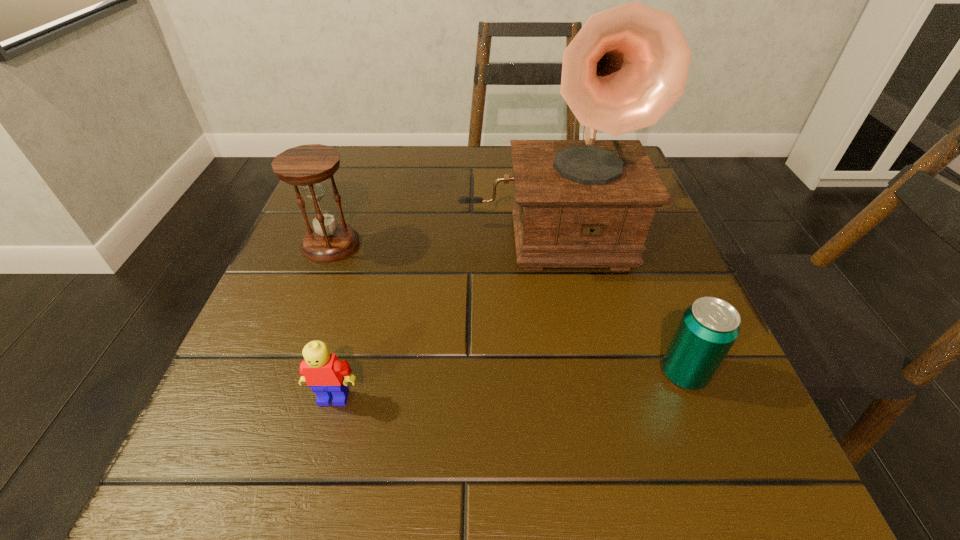
This screenshot has width=960, height=540. Find the location of `free spot between the beer can and the record player`. free spot between the beer can and the record player is located at coordinates (613, 301).

Find the location of a particular element. vacant area that lies between the Lego and the beer can is located at coordinates (509, 386).

Identify the location of vacant region between the tallest object and the beer can. (613, 301).

You are a GUI agent. You are given a task and a screenshot of the screen. Output one action in this format:
    pyautogui.click(x=<x>, y=<y>)
    Task: Click on the free spot between the tallest object and the hourglass
    Image resolution: width=960 pixels, height=540 pixels.
    Given the screenshot: What is the action you would take?
    pyautogui.click(x=438, y=237)

This screenshot has height=540, width=960. Find the location of `free point between the tallest object and the Lego`. free point between the tallest object and the Lego is located at coordinates (439, 313).

Image resolution: width=960 pixels, height=540 pixels. I want to click on free space between the Lego and the hourglass, so click(332, 321).

Where is `vacant space that's between the third shortest object and the Lego`? vacant space that's between the third shortest object and the Lego is located at coordinates (332, 321).

In order to click on unoccupied position between the beer can and the tallest object in this screenshot , I will do `click(613, 301)`.

Where is `free space between the third shortest object and the beer can`? free space between the third shortest object and the beer can is located at coordinates (508, 309).

Find the location of a particular element. Image resolution: width=960 pixels, height=540 pixels. object that can be found as the second closest to the Lego is located at coordinates (309, 166).